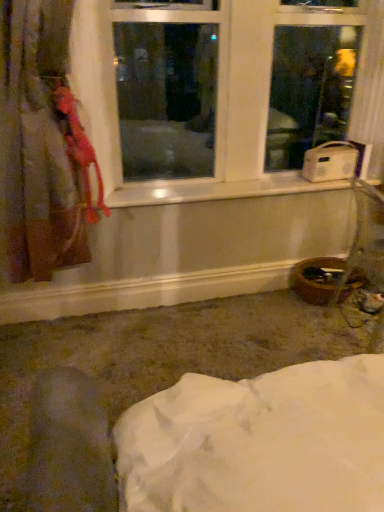
Question: Can you confirm if white plastic window at upper center is smaller than white plastic radio at right?

Choices:
 (A) no
 (B) yes

Answer: (A)

Question: From the image's perspective, does white plastic window at upper center appear higher than white plastic radio at right?

Choices:
 (A) no
 (B) yes

Answer: (B)

Question: Can you confirm if white plastic window at upper center is positioned to the left of white plastic radio at right?

Choices:
 (A) yes
 (B) no

Answer: (A)

Question: From the image's perspective, is white plastic window at upper center below white plastic radio at right?

Choices:
 (A) yes
 (B) no

Answer: (B)

Question: Is white plastic window at upper center next to white plastic radio at right and touching it?

Choices:
 (A) yes
 (B) no

Answer: (B)

Question: Is white plastic radio at right inside the boundaries of white plastic window at upper center, or outside?

Choices:
 (A) inside
 (B) outside

Answer: (A)

Question: Considering their positions, is white plastic radio at right located in front of or behind white plastic window at upper center?

Choices:
 (A) behind
 (B) front

Answer: (A)

Question: Considering the relative positions of white plastic radio at right and white plastic window at upper center in the image provided, is white plastic radio at right to the left or to the right of white plastic window at upper center?

Choices:
 (A) left
 (B) right

Answer: (B)

Question: Considering the positions of white plastic radio at right and white plastic window at upper center in the image, is white plastic radio at right taller or shorter than white plastic window at upper center?

Choices:
 (A) short
 (B) tall

Answer: (A)

Question: From the image's perspective, is white plastic window sill at center above or below velvet-like pink curtain at left?

Choices:
 (A) below
 (B) above

Answer: (A)

Question: Considering the positions of point tap(235, 186) and point tap(34, 231), is point tap(235, 186) closer or farther from the camera than point tap(34, 231)?

Choices:
 (A) closer
 (B) farther

Answer: (B)

Question: Based on their sizes in the image, would you say white plastic window sill at center is bigger or smaller than velvet-like pink curtain at left?

Choices:
 (A) big
 (B) small

Answer: (B)

Question: Looking at their shapes, would you say white plastic window sill at center is wider or thinner than velvet-like pink curtain at left?

Choices:
 (A) thin
 (B) wide

Answer: (A)

Question: Based on their sizes in the image, would you say velvet-like pink curtain at left is bigger or smaller than white plastic radio at right?

Choices:
 (A) small
 (B) big

Answer: (B)

Question: Is point (14, 14) positioned closer to the camera than point (302, 164)?

Choices:
 (A) closer
 (B) farther

Answer: (A)